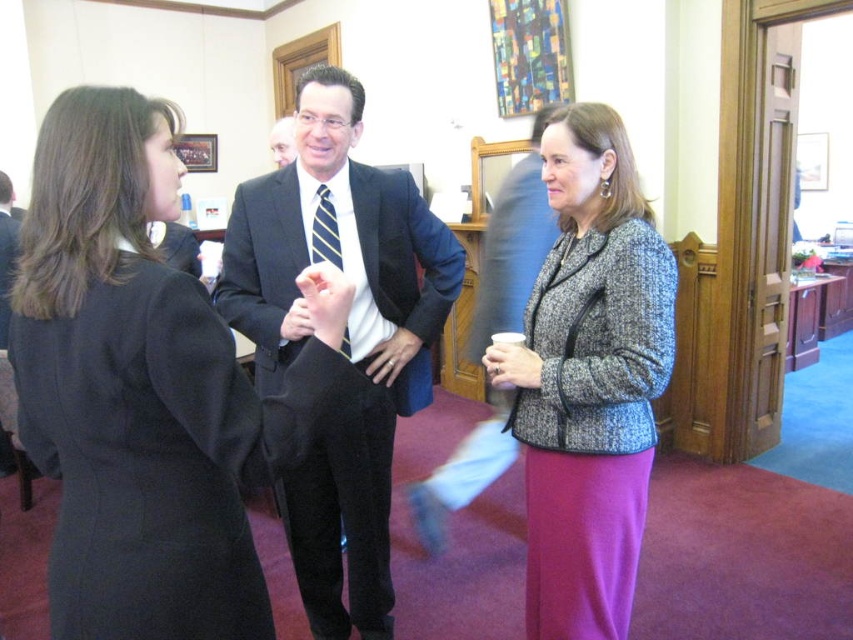
Question: Is speckled woolen jacket at right above striped fabric tie at center?

Choices:
 (A) no
 (B) yes

Answer: (A)

Question: From the image, what is the correct spatial relationship of black suit at center in relation to speckled woolen jacket at right?

Choices:
 (A) above
 (B) below

Answer: (B)

Question: Can you confirm if black suit at center is positioned below speckled woolen jacket at right?

Choices:
 (A) yes
 (B) no

Answer: (A)

Question: Which of the following is the farthest from the observer?

Choices:
 (A) black suit at center
 (B) black wool coat at left
 (C) striped fabric tie at center
 (D) speckled woolen jacket at right

Answer: (C)

Question: Which of these objects is positioned farthest from the black wool coat at left?

Choices:
 (A) striped fabric tie at center
 (B) black suit at center
 (C) speckled woolen jacket at right

Answer: (A)

Question: Which object is positioned closest to the black wool coat at left?

Choices:
 (A) black suit at center
 (B) speckled woolen jacket at right
 (C) striped fabric tie at center

Answer: (A)